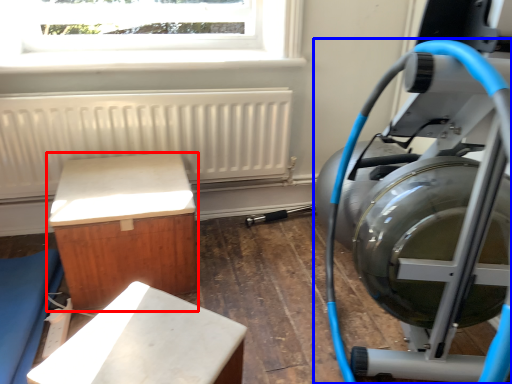
Question: Which object is closer to the camera taking this photo, furniture (highlighted by a red box) or stationary bicycle (highlighted by a blue box)?

Choices:
 (A) furniture
 (B) stationary bicycle

Answer: (B)